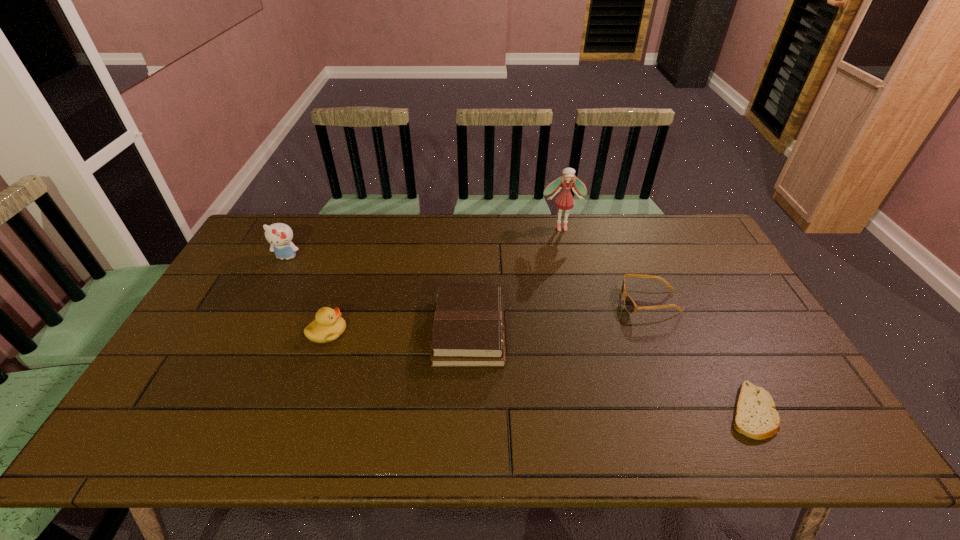
Find the location of a particular element. The height and width of the screenshot is (540, 960). pita bread is located at coordinates [755, 416].

The image size is (960, 540). I want to click on free space located 0.230m on the front-facing side of the fourth object from left to right, so click(573, 275).

This screenshot has width=960, height=540. What are the coordinates of `vacant region located 0.160m on the front-facing side of the fifth nearest object` in the screenshot? It's located at (265, 299).

In order to click on free space located 0.070m on the front-facing side of the third tallest object in this screenshot , I will do `click(372, 332)`.

This screenshot has width=960, height=540. Find the location of `vacant region located 0.300m on the spine side of the third object from left to right`. vacant region located 0.300m on the spine side of the third object from left to right is located at coordinates (612, 332).

Where is `vacant space located 0.080m on the front-facing side of the second shortest object`? The height and width of the screenshot is (540, 960). vacant space located 0.080m on the front-facing side of the second shortest object is located at coordinates (595, 302).

You are a GUI agent. You are given a task and a screenshot of the screen. Output one action in this format:
    pyautogui.click(x=<x>, y=<y>)
    Task: Click on the vacant region located 0.290m on the front-facing side of the second shortest object
    Image resolution: width=960 pixels, height=540 pixels.
    Given the screenshot: What is the action you would take?
    pyautogui.click(x=524, y=302)

Where is `vacant space located 0.160m on the front-facing side of the second shortest object`? Image resolution: width=960 pixels, height=540 pixels. vacant space located 0.160m on the front-facing side of the second shortest object is located at coordinates (568, 302).

The width and height of the screenshot is (960, 540). What are the coordinates of `free space located on the back of the pita bread` in the screenshot? It's located at (687, 286).

At what (x,y) coordinates should I click in order to perform the action: click on doll situated at the far edge. Please return your answer as a coordinate pair (x, y). The width and height of the screenshot is (960, 540). Looking at the image, I should click on (565, 201).